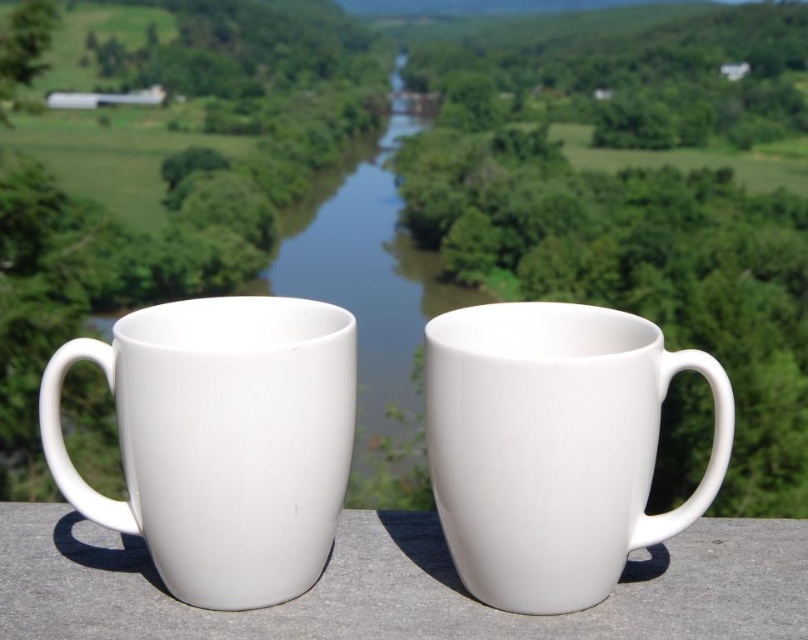
You are standing in front of two white ceramic mugs placed on a stone ledge. You notice a point marked at coordinates [221,440]. Which mug does this point correspond to?

The point at [221,440] corresponds to the white glossy mug at left.

You are a delivery robot with a 6 inch wide arm. You need to place a new mug between the white glossy mug at left and the white matte mug at center. Can your arm fit between them without knocking over either mug?

The white glossy mug at left and white matte mug at center are 5.42 inches apart from each other. Since your arm is 6 inches wide, it cannot fit between them without potentially knocking over either mug.